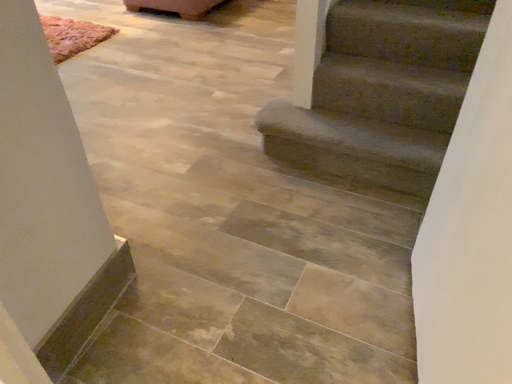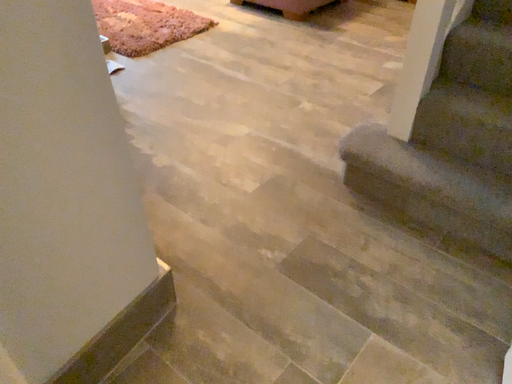
Question: How did the camera likely rotate when shooting the video?

Choices:
 (A) rotated right
 (B) rotated left

Answer: (B)